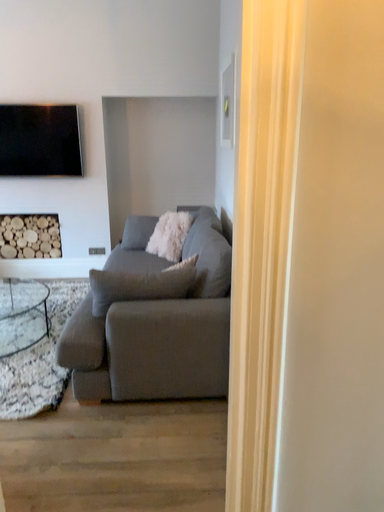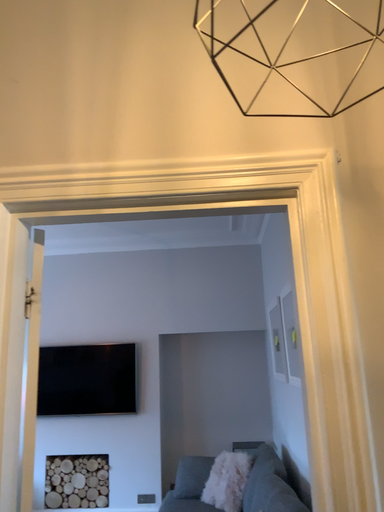
Question: Which way did the camera rotate in the video?

Choices:
 (A) rotated upward
 (B) rotated downward

Answer: (A)